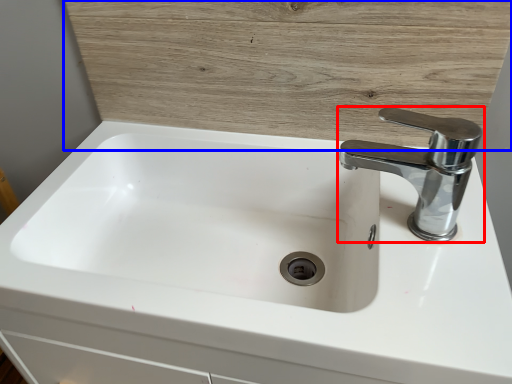
Question: Which point is further to the camera, tap (highlighted by a red box) or wood (highlighted by a blue box)?

Choices:
 (A) tap
 (B) wood

Answer: (B)